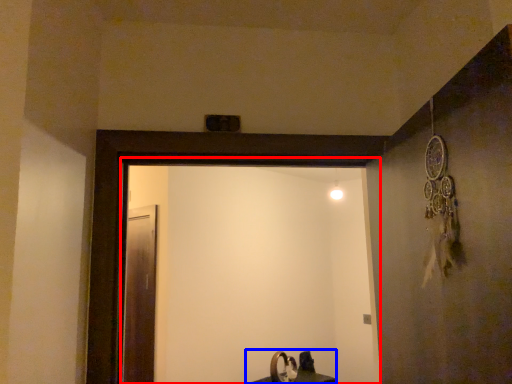
Question: Which object is closer to the camera taking this photo, screen door (highlighted by a red box) or sink (highlighted by a blue box)?

Choices:
 (A) screen door
 (B) sink

Answer: (A)